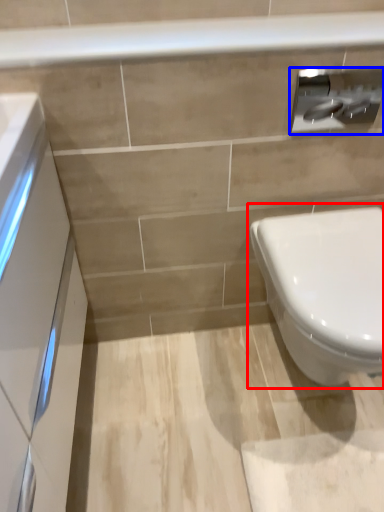
Question: Which object is closer to the camera taking this photo, toilet (highlighted by a red box) or toilet paper (highlighted by a blue box)?

Choices:
 (A) toilet
 (B) toilet paper

Answer: (A)